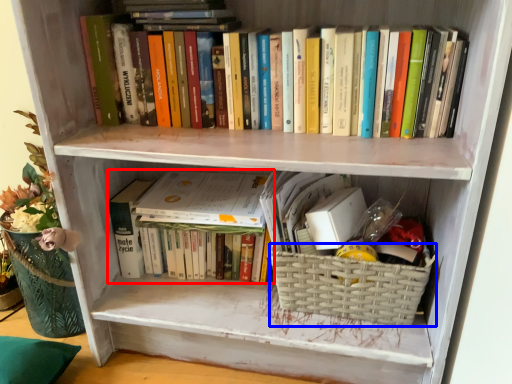
Question: Among these objects, which one is nearest to the camera, book (highlighted by a red box) or basket (highlighted by a blue box)?

Choices:
 (A) book
 (B) basket

Answer: (B)